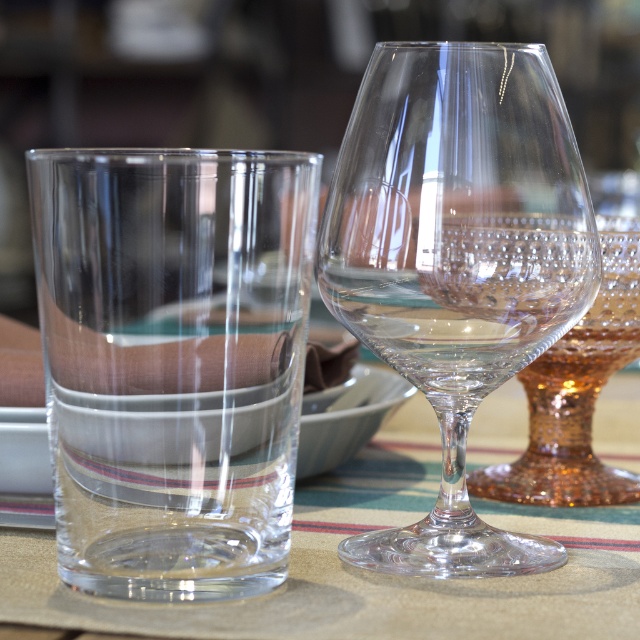
You are setting up a table and want to place the transparent glass at left on the clear fabric placemat at center. Is the glass currently placed on the placemat?

The transparent glass at left is positioned over clear fabric placemat at center, so yes, the glass is currently placed on the placemat.

In the scene shown: You are setting up a dining table and need to place the clear crystal wine glass at center on top of the clear fabric placemat at center. Will the glass fit entirely on the placemat without hanging over the edges?

The clear crystal wine glass at center is taller than clear fabric placemat at center, so the glass may not fit entirely on the placemat without hanging over the edges because its height exceeds the placemat.

You are a delivery person who needs to place a small package on the table. The package must be placed exactly at the coordinates where the transparent glass at left is located. What is the coordinate you should target?

The coordinate you should target is point (x=173, y=362), where the transparent glass at left is located.